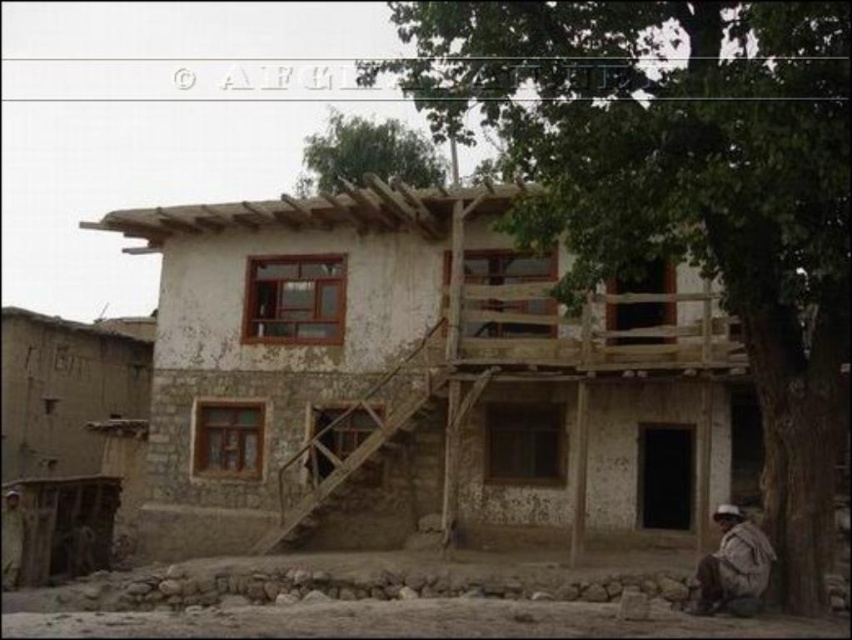
Question: Among these points, which one is nearest to the camera?

Choices:
 (A) (436, 218)
 (B) (9, 568)
 (C) (744, 16)

Answer: (C)

Question: Is green leafy tree at upper right wider than brown textured fabric at lower left?

Choices:
 (A) no
 (B) yes

Answer: (B)

Question: Among these points, which one is nearest to the camera?

Choices:
 (A) coord(12,564)
 (B) coord(845,72)
 (C) coord(718,596)

Answer: (B)

Question: Does green leafy tree at upper right have a larger size compared to brown textured fabric at lower left?

Choices:
 (A) yes
 (B) no

Answer: (A)

Question: Which point is closer to the camera?

Choices:
 (A) brown fabric hat at lower right
 (B) green leafy tree at upper center
 (C) white plastered house at center
 (D) brown textured fabric at lower left

Answer: (A)

Question: Can you confirm if green leafy tree at upper center is positioned above brown fabric hat at lower right?

Choices:
 (A) yes
 (B) no

Answer: (A)